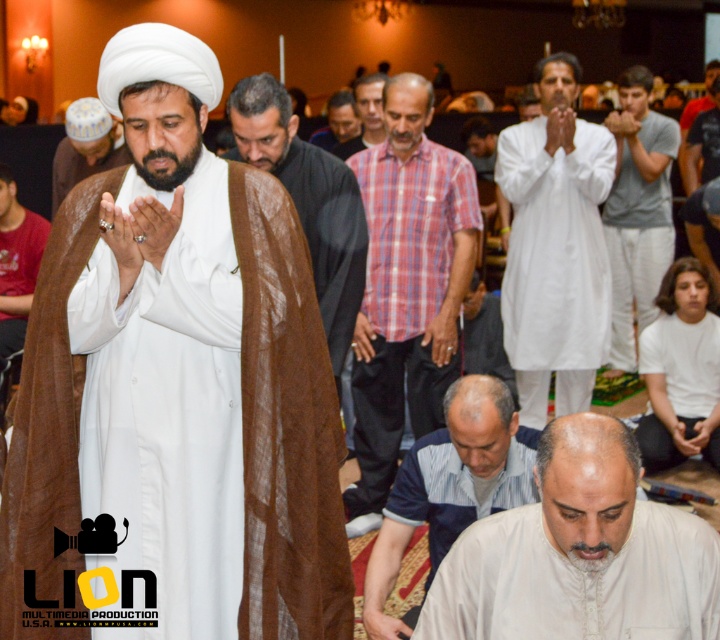
Question: Which object is positioned farthest from the brown fabric shawl at center?

Choices:
 (A) white matte turban at upper left
 (B) light brown shirt at center
 (C) white cotton kameez at center
 (D) white textured shirt at lower center

Answer: (B)

Question: Which point is closer to the camera?

Choices:
 (A) plaid cotton shirt at center
 (B) white matte robe at center
 (C) white textured shirt at lower center
 (D) white matte turban at upper left

Answer: (C)

Question: Which point is closer to the camera?

Choices:
 (A) (217, 602)
 (B) (379, 90)

Answer: (A)

Question: Observing the image, what is the correct spatial positioning of plaid cotton shirt at center in reference to blue striped shirt at lower center?

Choices:
 (A) above
 (B) below

Answer: (A)

Question: Does white textured shirt at lower center have a larger size compared to red shirt at left?

Choices:
 (A) no
 (B) yes

Answer: (A)

Question: Is plaid cotton shirt at center to the right of gray cotton shirt at center from the viewer's perspective?

Choices:
 (A) no
 (B) yes

Answer: (A)